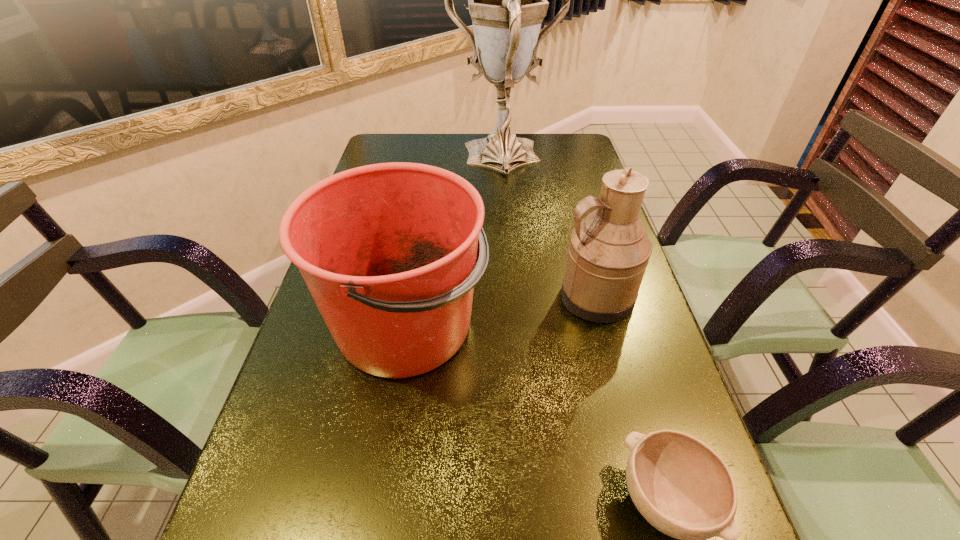
You are a GUI agent. You are given a task and a screenshot of the screen. Output one action in this format:
    pyautogui.click(x=<x>, y=<y>)
    Task: Click on the tallest object
    This screenshot has width=960, height=540.
    Given the screenshot: What is the action you would take?
    pyautogui.click(x=507, y=0)

The width and height of the screenshot is (960, 540). I want to click on trophy cup, so click(507, 0).

This screenshot has height=540, width=960. I want to click on pitcher, so click(608, 253).

Identify the location of bucket. The height and width of the screenshot is (540, 960). (388, 251).

You are a GUI agent. You are given a task and a screenshot of the screen. Output one action in this format:
    pyautogui.click(x=<x>, y=<y>)
    Task: Click on the free space located 0.180m on the front of the trophy cup
    
    Given the screenshot: What is the action you would take?
    pyautogui.click(x=509, y=221)

The image size is (960, 540). Identify the location of vacant space positioned 0.050m on the left of the pitcher. (536, 296).

At what (x,y) coordinates should I click in order to perform the action: click on free location located 0.080m on the front of the bucket. Please return your answer as a coordinate pair (x, y). Looking at the image, I should click on (386, 447).

You are a GUI agent. You are given a task and a screenshot of the screen. Output one action in this format:
    pyautogui.click(x=<x>, y=<y>)
    Task: Click on the object at the far edge
    This screenshot has height=540, width=960.
    Given the screenshot: What is the action you would take?
    pyautogui.click(x=507, y=0)

Where is `object positioned at the left edge`? Image resolution: width=960 pixels, height=540 pixels. object positioned at the left edge is located at coordinates (388, 251).

Where is `trophy cup located in the right edge section of the desktop`? This screenshot has height=540, width=960. trophy cup located in the right edge section of the desktop is located at coordinates (507, 0).